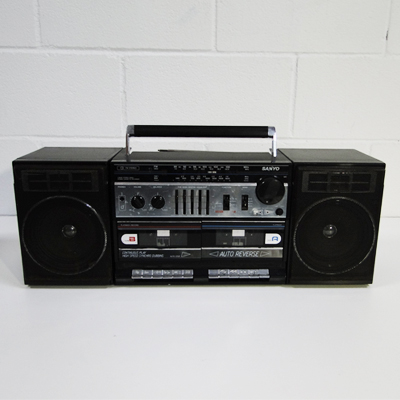
Locate an element on the screen. The height and width of the screenshot is (400, 400). boombox is located at coordinates (99, 168).